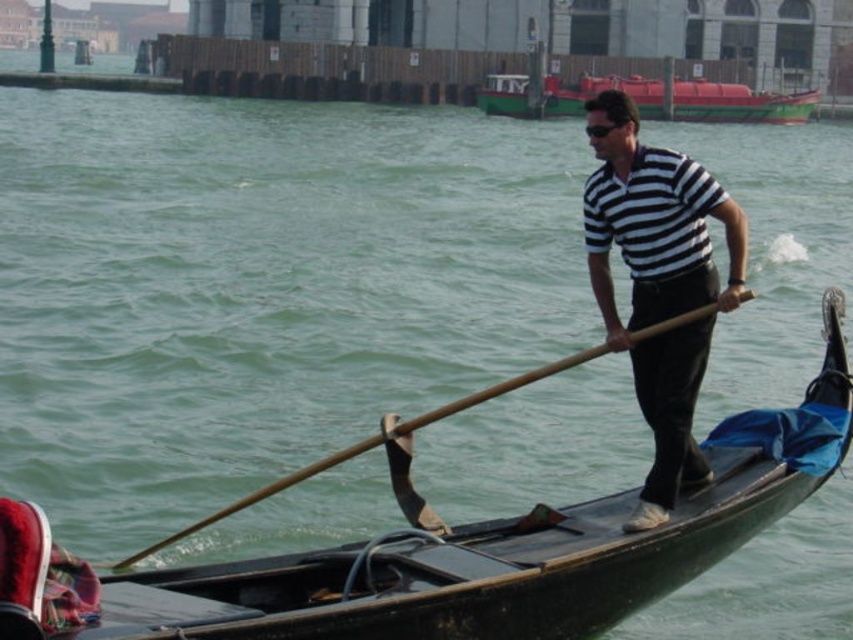
You are a tourist standing on the canal bridge and see the green matte boat at upper center and the wooden at right. Which boat is closer to the bridge? Please explain your reasoning based on their positions.

The green matte boat at upper center is positioned on the right side of the wooden at right, meaning it is closer to the bridge since it is to the right of the wooden boat.

You are a tourist standing on the canal bridge and want to know which object is shorter between the green matte boat at upper center and the wooden at right. According to the scene, which one is shorter?

The green matte boat at upper center has a lesser height compared to wooden at right, so the green matte boat at upper center is shorter.

You are standing on the canal bank and want to board the green matte boat at upper center. There is a wooden at right nearby. Which boat will you reach first if you swim straight towards them?

You will reach the green matte boat at upper center first because it is closer to you than the wooden at right, which is further away.